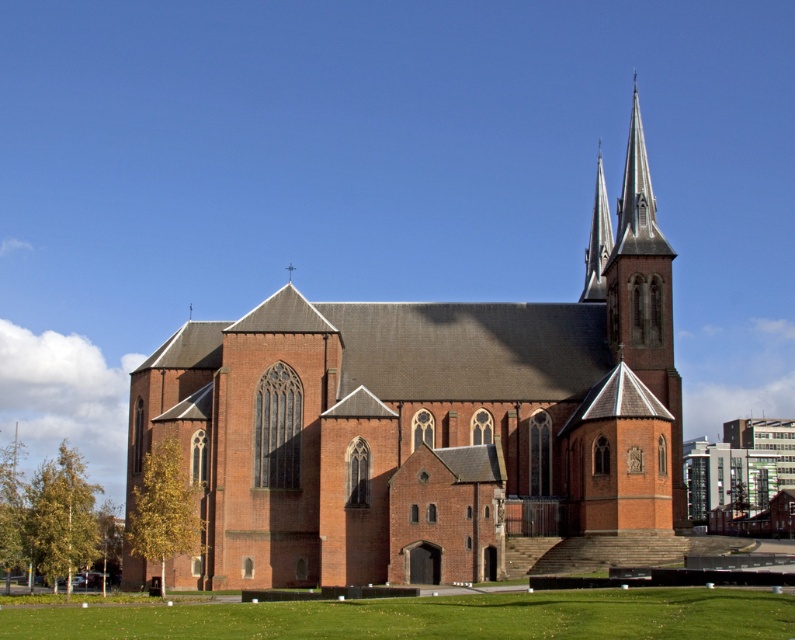
Does red brick church at center lie behind red brick church steeple at upper right?

No, it is in front of red brick church steeple at upper right.

Where is `red brick church at center`? The width and height of the screenshot is (795, 640). red brick church at center is located at coordinates (425, 422).

Describe the element at coordinates (425, 422) in the screenshot. The image size is (795, 640). I see `red brick church at center` at that location.

Identify the location of red brick church at center. (425, 422).

Does point (661, 280) come behind point (598, 218)?

That is False.

Which is above, red brick church steeple at upper right or smooth stone spire at upper right?

red brick church steeple at upper right is above.

Which is in front, point (669, 268) or point (603, 282)?

Positioned in front is point (669, 268).

Locate an element on the screen. red brick church steeple at upper right is located at coordinates (638, 291).

Does red brick church at center appear on the left side of smooth stone spire at upper right?

Yes, red brick church at center is to the left of smooth stone spire at upper right.

Is red brick church at center below smooth stone spire at upper right?

Incorrect, red brick church at center is not positioned below smooth stone spire at upper right.

Which is behind, point (303, 429) or point (598, 157)?

The point (598, 157) is behind.

The height and width of the screenshot is (640, 795). In order to click on red brick church at center in this screenshot , I will do `click(425, 422)`.